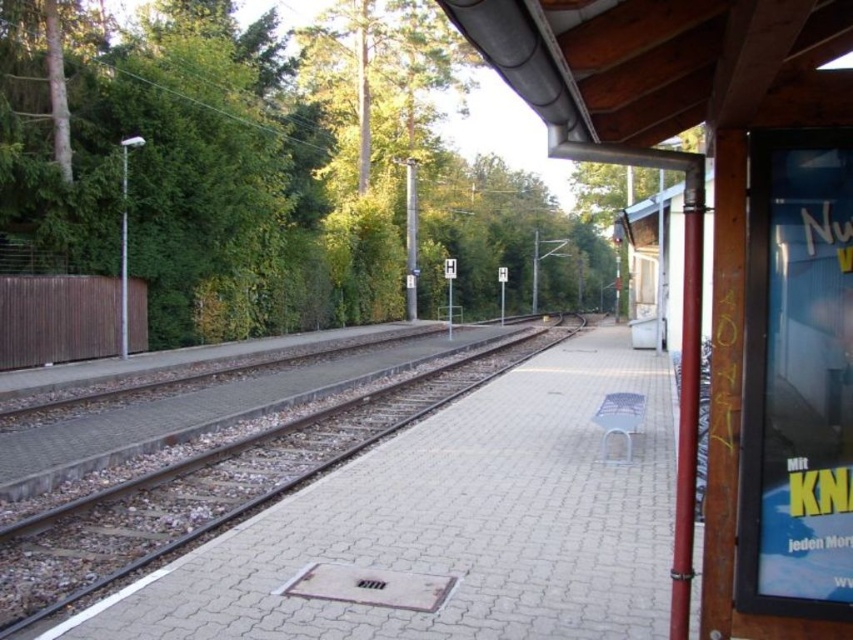
Is point (815, 449) behind point (148, 536)?

No, it is in front of (148, 536).

This screenshot has width=853, height=640. Find the location of `blue glossy poster at right`. blue glossy poster at right is located at coordinates click(x=798, y=378).